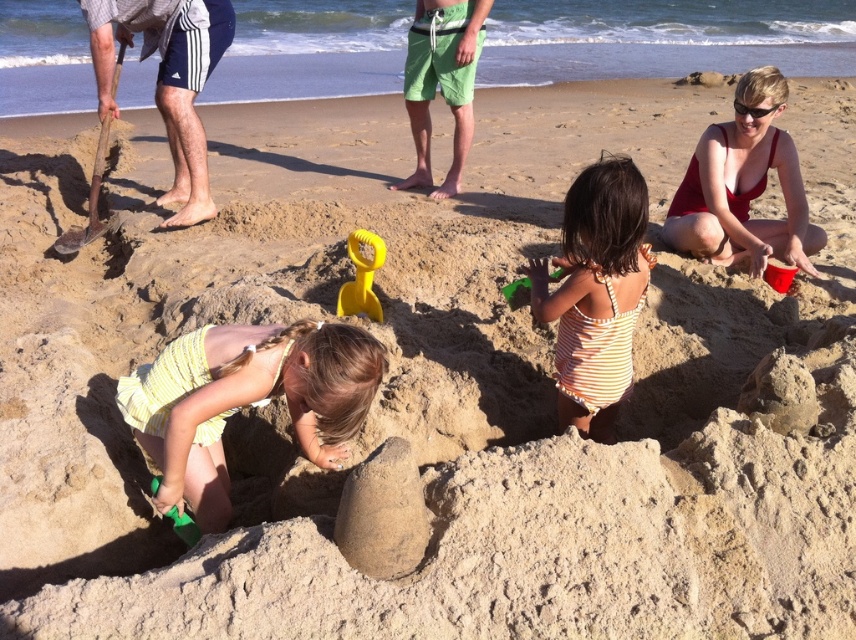
Question: Is striped cotton swimsuit at center below green plastic shovel at center?

Choices:
 (A) no
 (B) yes

Answer: (B)

Question: Which object is closer to the camera taking this photo?

Choices:
 (A) wooden shovel at left
 (B) yellow plastic shovel at center
 (C) green cotton shorts at center
 (D) green plastic shovel at center

Answer: (B)

Question: Does green cotton shorts at center appear over red plastic bucket at lower right?

Choices:
 (A) no
 (B) yes

Answer: (B)

Question: Based on their relative distances, which object is nearer to the green cotton shorts at center?

Choices:
 (A) yellow plastic shovel at center
 (B) yellow striped swimsuit at center
 (C) green plastic shovel at center
 (D) wooden shovel at left

Answer: (D)

Question: Which point is closer to the camera taking this photo?

Choices:
 (A) (217, 26)
 (B) (520, 285)
 (C) (358, 291)
 (D) (771, 246)

Answer: (B)

Question: Is matte red swimsuit at upper right thinner than dark blue shorts at left?

Choices:
 (A) no
 (B) yes

Answer: (A)